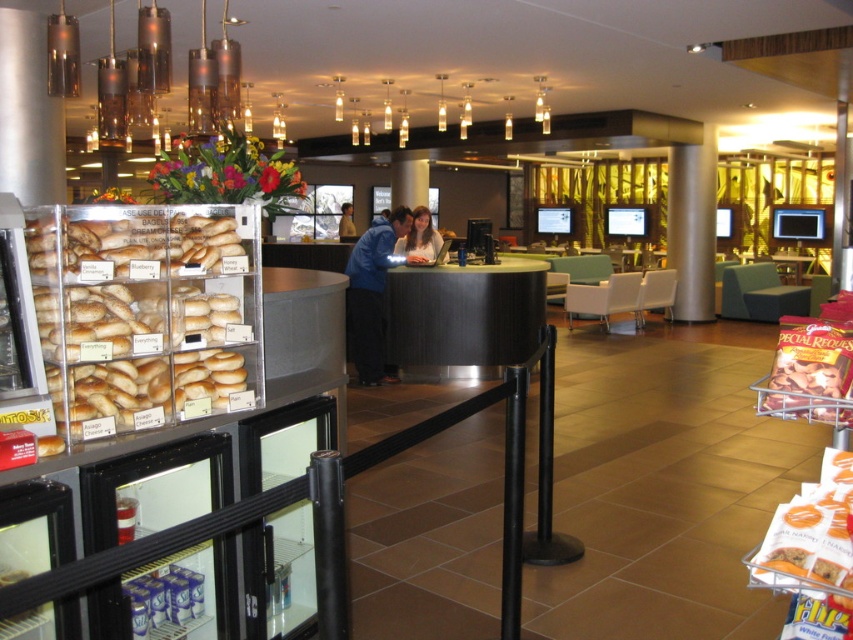
Question: Estimate the real-world distances between objects in this image. Which object is farther from the golden brown bagels at left?

Choices:
 (A) silver metallic pillar at center
 (B) blue fabric shirt at center

Answer: (B)

Question: Is golden brown bagels at left smaller than blue shirt at center?

Choices:
 (A) no
 (B) yes

Answer: (B)

Question: Which point is farther to the camera?

Choices:
 (A) (380, 372)
 (B) (677, 275)

Answer: (B)

Question: Is golden brown bagels at left above blue fabric shirt at center?

Choices:
 (A) no
 (B) yes

Answer: (A)

Question: Does golden brown bagels at left have a greater width compared to blue shirt at center?

Choices:
 (A) no
 (B) yes

Answer: (A)

Question: Which object is farther from the camera taking this photo?

Choices:
 (A) golden brown bagels at left
 (B) blue fabric shirt at center
 (C) silver metallic pillar at center
 (D) matte blue shirt at center

Answer: (B)